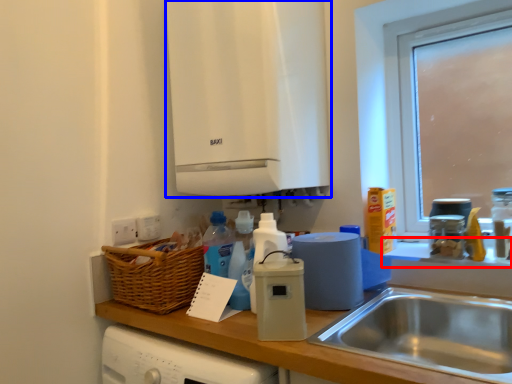
Question: Among these objects, which one is farthest to the camera, window sill (highlighted by a red box) or cabinetry (highlighted by a blue box)?

Choices:
 (A) window sill
 (B) cabinetry

Answer: (B)